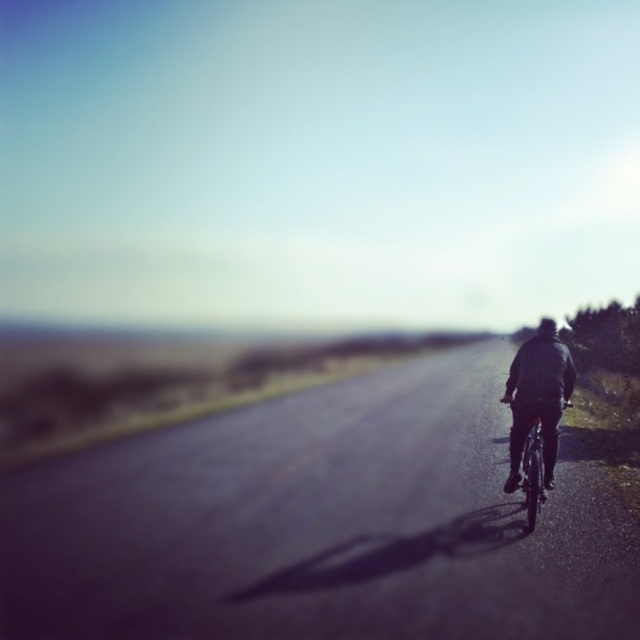
Question: Observing the image, what is the correct spatial positioning of dark gray jacket at right in reference to metallic silver bicycle at center?

Choices:
 (A) below
 (B) above

Answer: (B)

Question: Which point is farther to the camera?

Choices:
 (A) (532, 353)
 (B) (538, 500)

Answer: (A)

Question: Is dark gray jacket at right wider than metallic silver bicycle at center?

Choices:
 (A) yes
 (B) no

Answer: (A)

Question: Can you confirm if dark gray jacket at right is thinner than metallic silver bicycle at center?

Choices:
 (A) no
 (B) yes

Answer: (A)